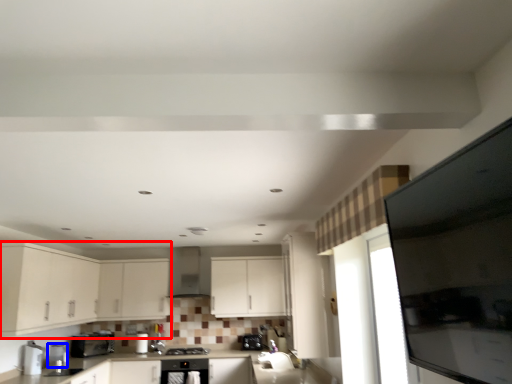
Question: Among these objects, which one is nearest to the camera, cabinetry (highlighted by a red box) or appliance (highlighted by a blue box)?

Choices:
 (A) cabinetry
 (B) appliance

Answer: (A)